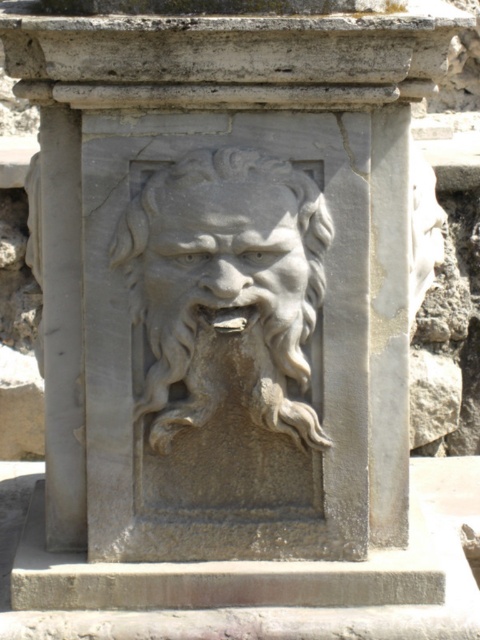
Question: Which of the following is the closest to the observer?

Choices:
 (A) gray stone face at center
 (B) gray stone lion at center

Answer: (A)

Question: Among these points, which one is nearest to the camera?

Choices:
 (A) (158, 452)
 (B) (164, 195)

Answer: (B)

Question: Can you confirm if gray stone lion at center is positioned to the right of gray stone face at center?

Choices:
 (A) no
 (B) yes

Answer: (A)

Question: Does gray stone lion at center have a lesser width compared to gray stone face at center?

Choices:
 (A) no
 (B) yes

Answer: (A)

Question: Is gray stone lion at center above gray stone face at center?

Choices:
 (A) yes
 (B) no

Answer: (B)

Question: Which point appears closest to the camera in this image?

Choices:
 (A) (168, 216)
 (B) (288, 200)

Answer: (A)